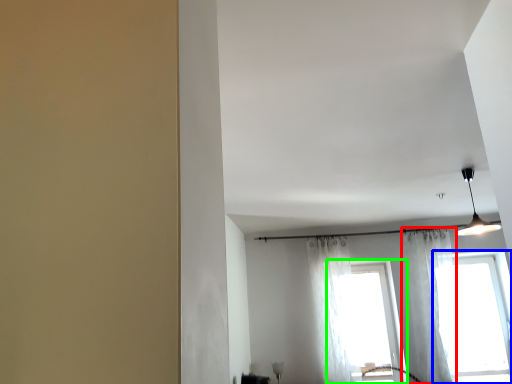
Question: Which object is positioned closest to curtain (highlighted by a red box)? Select from window (highlighted by a blue box) and window (highlighted by a green box).

Choices:
 (A) window
 (B) window

Answer: (A)